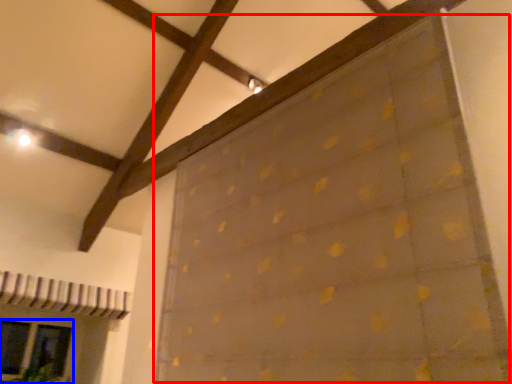
Question: Among these objects, which one is farthest to the camera, curtain (highlighted by a red box) or glass door (highlighted by a blue box)?

Choices:
 (A) curtain
 (B) glass door

Answer: (B)